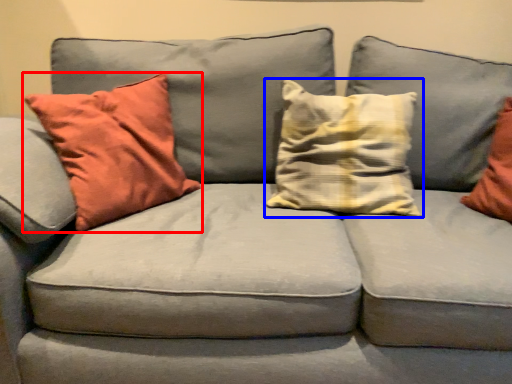
Question: Which object is further to the camera taking this photo, pillow (highlighted by a red box) or pillow (highlighted by a blue box)?

Choices:
 (A) pillow
 (B) pillow

Answer: (B)